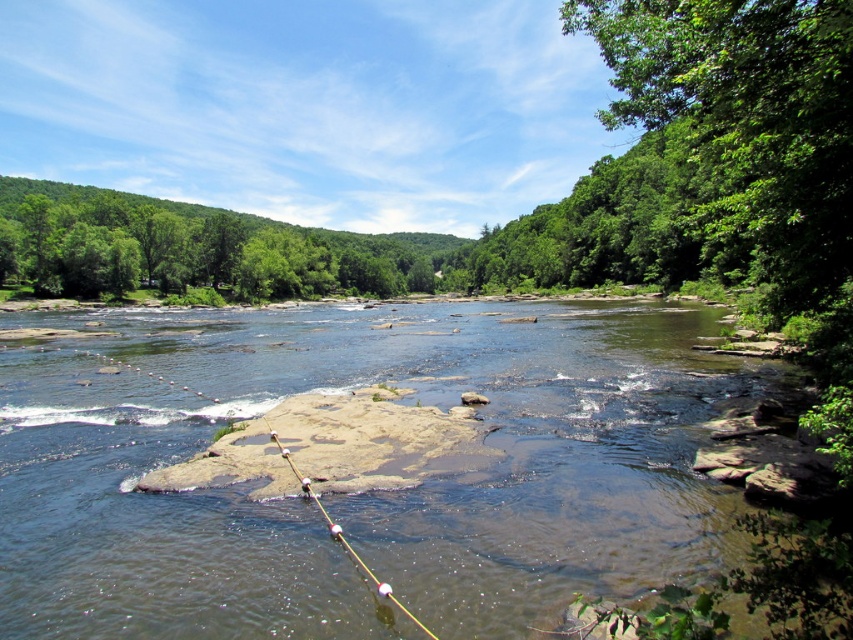
Does brown rocky stream at center have a smaller size compared to white plastic fishing pole at center?

No.

Who is positioned more to the right, brown rocky stream at center or white plastic fishing pole at center?

From the viewer's perspective, brown rocky stream at center appears more on the right side.

I want to click on brown rocky stream at center, so click(363, 493).